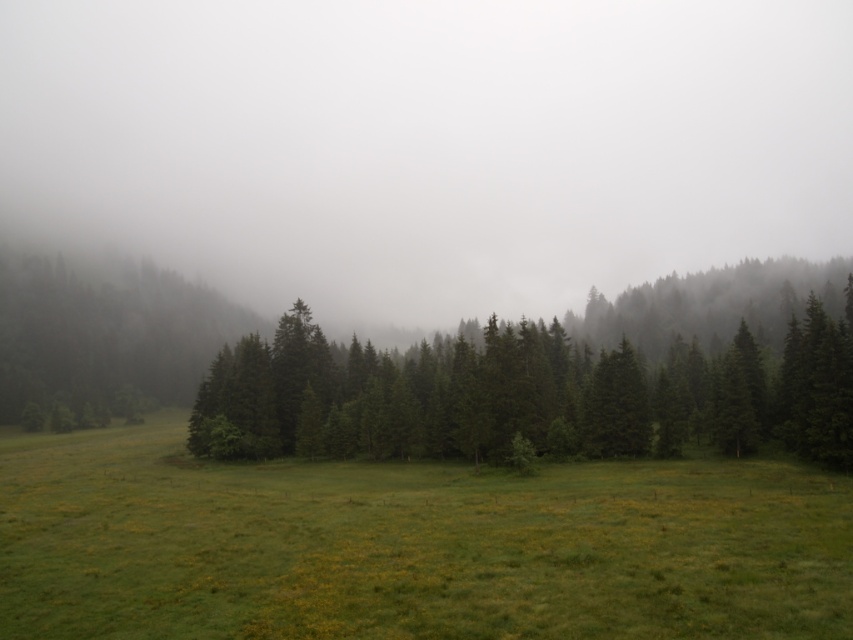
Based on the photo, you are a hiker standing in the green grass at center. You want to reach the green matte tree at center. Which direction should you move to get closer to the tree?

The green grass at center is positioned under the green matte tree at center, so you should move upward to get closer to the tree.

You are a hiker trying to cross the meadow. You notice the green grass at center and the green matte tree at center. Which one is narrower in width?

The green grass at center is thinner than the green matte tree at center, so the green grass at center is narrower in width.

You are an explorer navigating through the misty forest. You see the green grass at center and the green matte tree at center. Which object is positioned to the left?

The green grass at center is positioned to the left of the green matte tree at center.